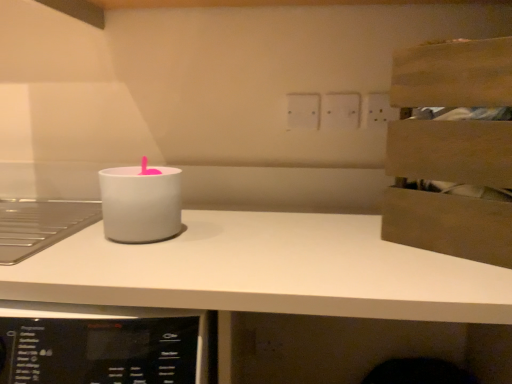
This screenshot has width=512, height=384. Identify the location of free space above white matte countertop at center (from a real-world perspective). (362, 246).